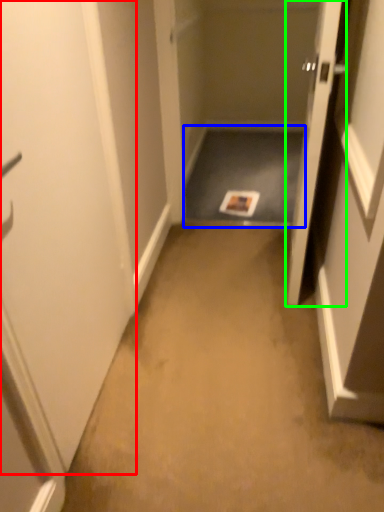
Question: Considering the real-world distances, which object is farthest from door (highlighted by a red box)? corridor (highlighted by a blue box) or door (highlighted by a green box)?

Choices:
 (A) corridor
 (B) door

Answer: (A)